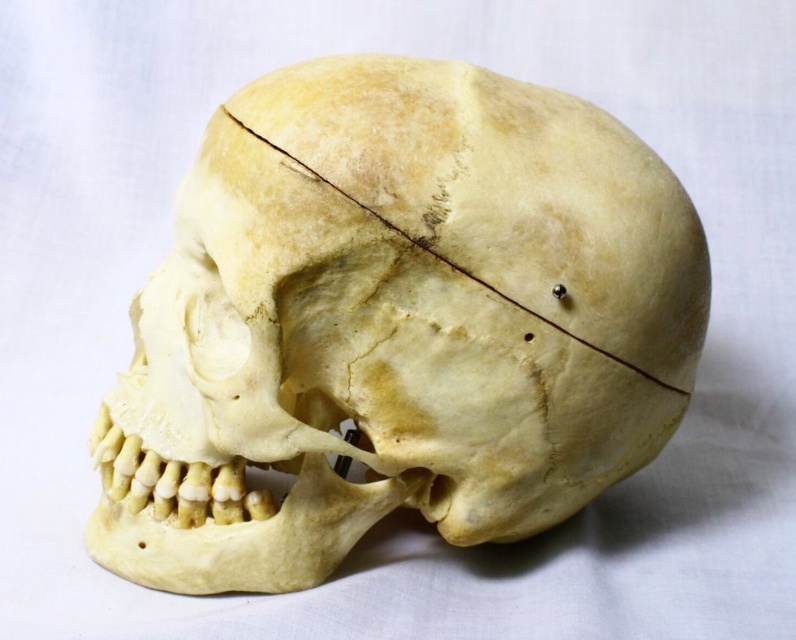
Question: Does yellowish bone skull at center appear on the left side of yellowish bone at center?

Choices:
 (A) yes
 (B) no

Answer: (A)

Question: Which of the following is the closest to the observer?

Choices:
 (A) (373, 188)
 (B) (306, 170)

Answer: (B)

Question: Does yellowish bone skull at center have a larger size compared to yellowish bone at center?

Choices:
 (A) no
 (B) yes

Answer: (B)

Question: Which object is farther from the camera taking this photo?

Choices:
 (A) yellowish bone at center
 (B) yellowish bone skull at center

Answer: (B)

Question: Is yellowish bone skull at center behind yellowish bone at center?

Choices:
 (A) yes
 (B) no

Answer: (A)